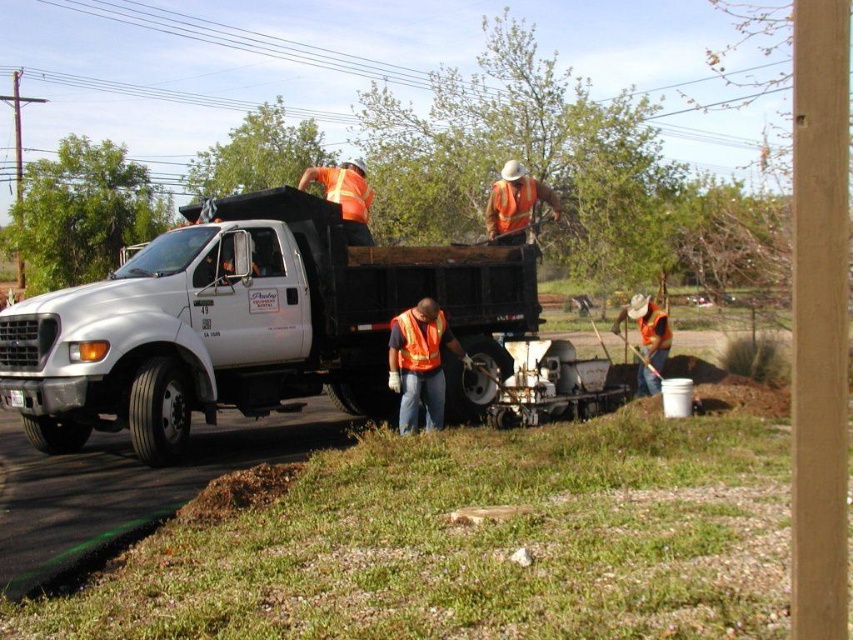
Question: Which of the following is the farthest from the observer?

Choices:
 (A) (421, 337)
 (B) (277, 324)
 (C) (416, 397)

Answer: (B)

Question: Is reflective orange vest at center thinner than orange reflective safety vest at center?

Choices:
 (A) no
 (B) yes

Answer: (A)

Question: Which object appears closest to the camera in this image?

Choices:
 (A) orange reflective safety vest at center
 (B) white matte truck at center
 (C) reflective orange vest at center

Answer: (B)

Question: Can you confirm if white matte truck at center is smaller than orange reflective safety vest at center?

Choices:
 (A) no
 (B) yes

Answer: (B)

Question: Can you confirm if white matte truck at center is positioned to the right of orange reflective safety vest at center?

Choices:
 (A) yes
 (B) no

Answer: (B)

Question: Which object is positioned closest to the orange reflective safety vest at center?

Choices:
 (A) reflective orange vest at center
 (B) white matte truck at center

Answer: (A)